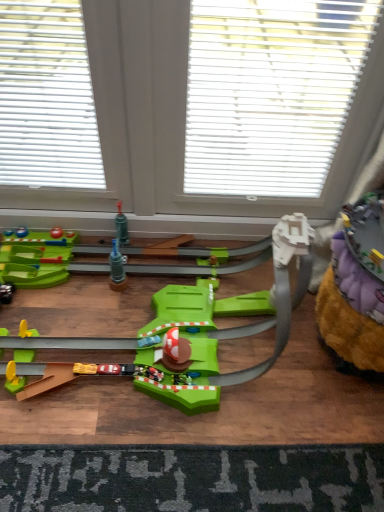
The height and width of the screenshot is (512, 384). Describe the element at coordinates (192, 478) in the screenshot. I see `dark gray textured mat at lower center` at that location.

What do you see at coordinates (355, 287) in the screenshot? This screenshot has height=512, width=384. I see `fuzzy yellow carpet at lower right, the first toy when ordered from right to left` at bounding box center [355, 287].

This screenshot has height=512, width=384. What are the coordinates of `fuzzy yellow carpet at lower right, the 2th toy viewed from the left` in the screenshot? It's located at (355, 287).

Find the location of a particular element. Image resolution: width=384 pixels, height=512 pixels. dark gray textured mat at lower center is located at coordinates (192, 478).

From the image's perspective, which one is positioned lower, white plastic window at center or dark gray textured mat at lower center?

From the image's view, dark gray textured mat at lower center is below.

Does white plastic window at center come behind dark gray textured mat at lower center?

No, white plastic window at center is closer to the viewer.

Is white plastic window at center at the left side of dark gray textured mat at lower center?

Correct, you'll find white plastic window at center to the left of dark gray textured mat at lower center.

Is point (35, 366) closer or farther from the camera than point (296, 464)?

Point (35, 366) appears to be farther away from the viewer than point (296, 464).

From their relative heights in the image, would you say green plastic track at center, the 2th toy viewed from the right, is taller or shorter than dark gray textured mat at lower center?

Clearly, green plastic track at center, the 2th toy viewed from the right, is taller compared to dark gray textured mat at lower center.

Is green plastic track at center, the 2th toy viewed from the right, next to dark gray textured mat at lower center and touching it?

No, green plastic track at center, the 2th toy viewed from the right, is not next to dark gray textured mat at lower center.

Is green plastic track at center, the 2th toy viewed from the right, not inside dark gray textured mat at lower center?

Indeed, green plastic track at center, the 2th toy viewed from the right, is completely outside dark gray textured mat at lower center.

From the image's perspective, would you say white plastic window at center is shown under white plastic blinds at upper center?

Indeed, from the image's perspective, white plastic window at center is shown beneath white plastic blinds at upper center.

Who is shorter, white plastic window at center or white plastic blinds at upper center?

Standing shorter between the two is white plastic blinds at upper center.

Can you tell me how much white plastic window at center and white plastic blinds at upper center differ in facing direction?

white plastic window at center and white plastic blinds at upper center are facing 1.44 degrees away from each other.

Can you see white plastic window at center touching white plastic blinds at upper center?

Yes, white plastic window at center is next to white plastic blinds at upper center.

In the image, is green plastic track at center, the 2th toy viewed from the right, positioned in front of or behind fuzzy yellow carpet at lower right, the 2th toy viewed from the left?

green plastic track at center, the 2th toy viewed from the right, is in front of fuzzy yellow carpet at lower right, the 2th toy viewed from the left.

From a real-world perspective, which is physically below, green plastic track at center, the 2th toy viewed from the right, or fuzzy yellow carpet at lower right, the 2th toy viewed from the left?

green plastic track at center, the 2th toy viewed from the right, is physically lower.

From the image's perspective, is green plastic track at center, the 2th toy viewed from the right, under fuzzy yellow carpet at lower right, the 2th toy viewed from the left?

No.

Between green plastic track at center, the 1th toy when ordered from left to right, and fuzzy yellow carpet at lower right, the first toy when ordered from right to left, which one appears on the left side from the viewer's perspective?

green plastic track at center, the 1th toy when ordered from left to right, is more to the left.

Image resolution: width=384 pixels, height=512 pixels. I want to click on blind above the fuzzy yellow carpet at lower right, the first toy when ordered from right to left (from the image's perspective), so click(x=271, y=92).

Based on the photo, between fuzzy yellow carpet at lower right, the 2th toy viewed from the left, and white plastic blinds at upper center, which one is positioned behind?

white plastic blinds at upper center is more distant.

Between point (350, 250) and point (280, 42), which one is positioned in front?

The point (350, 250) is in front.

Considering the sizes of objects dark gray textured mat at lower center and white plastic window at center in the image provided, who is thinner, dark gray textured mat at lower center or white plastic window at center?

With smaller width is white plastic window at center.

Is dark gray textured mat at lower center positioned far away from white plastic window at center?

dark gray textured mat at lower center is near white plastic window at center, not far away.

Is dark gray textured mat at lower center situated inside white plastic window at center or outside?

dark gray textured mat at lower center cannot be found inside white plastic window at center.

Which point is more distant from viewer, [11,483] or [372,220]?

Positioned behind is point [11,483].

Would you say dark gray textured mat at lower center is to the left or to the right of fuzzy yellow carpet at lower right, the 2th toy viewed from the left, in the picture?

dark gray textured mat at lower center is positioned on fuzzy yellow carpet at lower right, the 2th toy viewed from the left,'s left side.

Locate an element on the screen. This screenshot has width=384, height=512. mat located behind the fuzzy yellow carpet at lower right, the 2th toy viewed from the left is located at coordinates (192, 478).

Identify the location of mat on the right of the white plastic window at center. (192, 478).

Identify the location of mat below the green plastic track at center, the 2th toy viewed from the right (from a real-world perspective). This screenshot has height=512, width=384. (192, 478).

Looking at the image, which one is located further to white plastic blinds at upper center, dark gray textured mat at lower center or white plastic window at center?

dark gray textured mat at lower center lies further to white plastic blinds at upper center than the other object.

Based on their spatial positions, is fuzzy yellow carpet at lower right, the first toy when ordered from right to left, or white plastic window at center further from dark gray textured mat at lower center?

white plastic window at center lies further to dark gray textured mat at lower center than the other object.

From the image, which object appears to be farther from white plastic window at center, white plastic blinds at upper center or green plastic track at center, the 1th toy when ordered from left to right?

green plastic track at center, the 1th toy when ordered from left to right, is positioned further to the anchor white plastic window at center.

Based on their spatial positions, is white plastic window at center or fuzzy yellow carpet at lower right, the 2th toy viewed from the left, closer to green plastic track at center, the 1th toy when ordered from left to right?

Based on the image, fuzzy yellow carpet at lower right, the 2th toy viewed from the left, appears to be nearer to green plastic track at center, the 1th toy when ordered from left to right.

Based on their spatial positions, is white plastic blinds at upper center or dark gray textured mat at lower center closer to green plastic track at center, the 2th toy viewed from the right?

The object closer to green plastic track at center, the 2th toy viewed from the right, is dark gray textured mat at lower center.

Based on their spatial positions, is green plastic track at center, the 1th toy when ordered from left to right, or white plastic blinds at upper center closer to white plastic window at center?

white plastic blinds at upper center lies closer to white plastic window at center than the other object.

From the image, which object appears to be nearer to green plastic track at center, the 2th toy viewed from the right, white plastic blinds at upper center or fuzzy yellow carpet at lower right, the 2th toy viewed from the left?

fuzzy yellow carpet at lower right, the 2th toy viewed from the left.

Based on their spatial positions, is white plastic window at center or white plastic blinds at upper center closer to fuzzy yellow carpet at lower right, the first toy when ordered from right to left?

white plastic blinds at upper center lies closer to fuzzy yellow carpet at lower right, the first toy when ordered from right to left, than the other object.

Locate an element on the screen. The height and width of the screenshot is (512, 384). window between white plastic blinds at upper center and green plastic track at center, the 1th toy when ordered from left to right, vertically is located at coordinates (201, 122).

Find the location of `blind between green plastic track at center, the 1th toy when ordered from left to right, and fuzzy yellow carpet at lower right, the first toy when ordered from right to left, from left to right`. blind between green plastic track at center, the 1th toy when ordered from left to right, and fuzzy yellow carpet at lower right, the first toy when ordered from right to left, from left to right is located at coordinates (271, 92).

Identify the location of window between green plastic track at center, the 2th toy viewed from the right, and fuzzy yellow carpet at lower right, the 2th toy viewed from the left, in the horizontal direction. (201, 122).

You are a GUI agent. You are given a task and a screenshot of the screen. Output one action in this format:
    pyautogui.click(x=<x>, y=<y>)
    Task: Click on the window that lies between white plastic blinds at upper center and dark gray textured mat at lower center from top to bottom
    This screenshot has height=512, width=384.
    Given the screenshot: What is the action you would take?
    point(201,122)